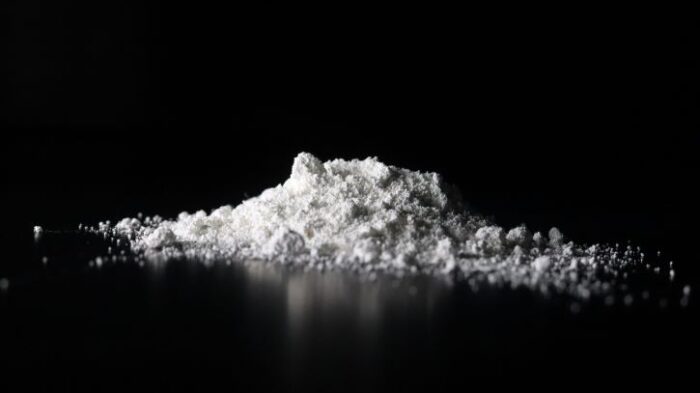
Identify the location of table. (190, 331).